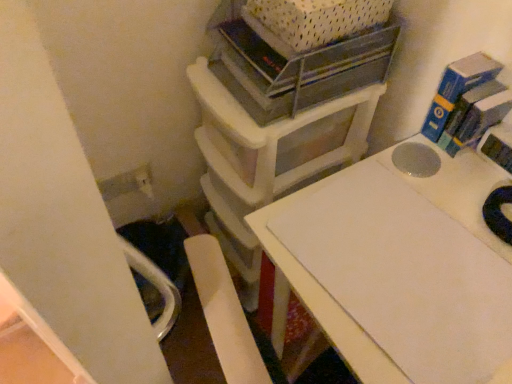
This screenshot has width=512, height=384. What do you see at coordinates (267, 157) in the screenshot?
I see `white plastic storage unit at upper center` at bounding box center [267, 157].

Locate an element on the screen. This screenshot has width=512, height=384. metallic gray shelf at upper center is located at coordinates (294, 63).

Where is `furniture that appears above the white matte table at center (from the image's perspective)`? furniture that appears above the white matte table at center (from the image's perspective) is located at coordinates (267, 157).

Between white plastic storage unit at upper center and white matte table at center, which one has less height?

white matte table at center is shorter.

Which of these two, white plastic storage unit at upper center or white matte table at center, is bigger?

With larger size is white matte table at center.

Measure the distance between white plastic storage unit at upper center and white matte table at center.

11.12 inches.

In terms of height, does metallic gray shelf at upper center look taller or shorter compared to white plastic storage unit at upper center?

Answer: Considering their sizes, metallic gray shelf at upper center has less height than white plastic storage unit at upper center.

Which object is positioned more to the left, metallic gray shelf at upper center or white plastic storage unit at upper center?

Positioned to the left is white plastic storage unit at upper center.

Can you confirm if metallic gray shelf at upper center is smaller than white plastic storage unit at upper center?

Indeed, metallic gray shelf at upper center has a smaller size compared to white plastic storage unit at upper center.

Considering the sizes of objects white plastic crate at upper center and metallic gray shelf at upper center in the image provided, who is shorter, white plastic crate at upper center or metallic gray shelf at upper center?

With less height is white plastic crate at upper center.

From the image's perspective, does white plastic crate at upper center appear higher than metallic gray shelf at upper center?

Indeed, from the image's perspective, white plastic crate at upper center is shown above metallic gray shelf at upper center.

Is white plastic crate at upper center in front of metallic gray shelf at upper center?

Yes, white plastic crate at upper center is closer to the viewer.

Looking at the image, does white plastic crate at upper center seem bigger or smaller compared to metallic gray shelf at upper center?

Considering their sizes, white plastic crate at upper center takes up less space than metallic gray shelf at upper center.

Is white plastic crate at upper center wider than white matte table at center?

Incorrect, the width of white plastic crate at upper center does not surpass that of white matte table at center.

Is white plastic crate at upper center oriented towards white matte table at center?

No, white plastic crate at upper center is not turned towards white matte table at center.

Which object is further away from the camera, white plastic crate at upper center or white matte table at center?

white plastic crate at upper center.

Would you say white plastic crate at upper center is inside or outside white matte table at center?

white plastic crate at upper center is outside white matte table at center.

From the picture: Is metallic gray shelf at upper center facing away from white matte table at center?

No.

Considering the sizes of metallic gray shelf at upper center and white matte table at center in the image, is metallic gray shelf at upper center bigger or smaller than white matte table at center?

Clearly, metallic gray shelf at upper center is smaller in size than white matte table at center.

Which is more to the right, metallic gray shelf at upper center or white matte table at center?

white matte table at center is more to the right.

Is white matte table at center positioned with its back to white plastic storage unit at upper center?

No.

Is white matte table at center at the right side of white plastic storage unit at upper center?

Yes.

Is white matte table at center placed right next to white plastic storage unit at upper center?

white matte table at center and white plastic storage unit at upper center are clearly separated.

From the image's perspective, does white matte table at center appear higher than white plastic storage unit at upper center?

No, from the image's perspective, white matte table at center is not on top of white plastic storage unit at upper center.

Is metallic gray shelf at upper center at the left side of white plastic crate at upper center?

Indeed, metallic gray shelf at upper center is positioned on the left side of white plastic crate at upper center.

You are a GUI agent. You are given a task and a screenshot of the screen. Output one action in this format:
    pyautogui.click(x=<x>, y=<y>)
    Task: Click on the crate above the metallic gray shelf at upper center (from a real-world perspective)
    The image size is (512, 384).
    Given the screenshot: What is the action you would take?
    pyautogui.click(x=317, y=19)

Which object is further away from the camera taking this photo, metallic gray shelf at upper center or white plastic crate at upper center?

metallic gray shelf at upper center.

Identify the location of furniture above the white matte table at center (from a real-world perspective). The width and height of the screenshot is (512, 384). (267, 157).

At what (x,y) coordinates should I click in order to perform the action: click on furniture behind the metallic gray shelf at upper center. Please return your answer as a coordinate pair (x, y). Looking at the image, I should click on (267, 157).

Considering their positions, is white plastic crate at upper center positioned further to white matte table at center than metallic gray shelf at upper center?

white plastic crate at upper center.

From the image, which object appears to be nearer to white plastic storage unit at upper center, white plastic crate at upper center or metallic gray shelf at upper center?

metallic gray shelf at upper center is closer to white plastic storage unit at upper center.

From the image, which object appears to be nearer to white plastic storage unit at upper center, white plastic crate at upper center or white matte table at center?

white matte table at center lies closer to white plastic storage unit at upper center than the other object.

Estimate the real-world distances between objects in this image. Which object is further from metallic gray shelf at upper center, white matte table at center or white plastic storage unit at upper center?

Based on the image, white matte table at center appears to be further to metallic gray shelf at upper center.

Based on their spatial positions, is white plastic storage unit at upper center or white plastic crate at upper center further from white matte table at center?

The object further to white matte table at center is white plastic crate at upper center.

Looking at the image, which one is located further to white plastic crate at upper center, white plastic storage unit at upper center or white matte table at center?

white matte table at center lies further to white plastic crate at upper center than the other object.

Estimate the real-world distances between objects in this image. Which object is further from white plastic crate at upper center, metallic gray shelf at upper center or white plastic storage unit at upper center?

white plastic storage unit at upper center is further to white plastic crate at upper center.

Based on their spatial positions, is metallic gray shelf at upper center or white plastic crate at upper center closer to white matte table at center?

metallic gray shelf at upper center.

This screenshot has height=384, width=512. Find the location of `shelf between white plastic crate at upper center and white plastic storage unit at upper center in the vertical direction`. shelf between white plastic crate at upper center and white plastic storage unit at upper center in the vertical direction is located at coordinates (294, 63).

Identify the location of furniture that lies between white plastic crate at upper center and white matte table at center from top to bottom. (267, 157).

Identify the location of shelf between white plastic crate at upper center and white matte table at center in the up-down direction. (294, 63).

At what (x,y) coordinates should I click in order to perform the action: click on furniture between metallic gray shelf at upper center and white matte table at center vertically. Please return your answer as a coordinate pair (x, y). The width and height of the screenshot is (512, 384). Looking at the image, I should click on (267, 157).